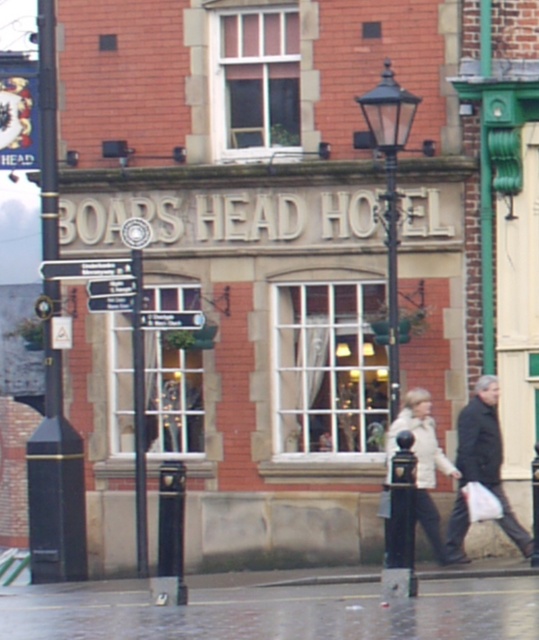
You are standing in front of the Boars Head Hotel and want to take a photo. There are two points of interest marked in the scene. The first point is at coordinates point (302, 632), and the second is at point (391, 445). Which point should you focus on to ensure it appears larger in your photo?

Point (302, 632) is closer to the camera than point (391, 445), so focusing on point (302, 632) will make it appear larger in the photo.

You are standing in front of the Boars Head Hotel and want to walk towards the black metal pole at left. Which direction should you move relative to the concrete pavement at lower center?

Since the concrete pavement at lower center is closer to the viewer than the black metal pole at left, you should move away from the concrete pavement at lower center to reach the black metal pole at left.

You are standing on the sidewalk in front of the Boars Head Hotel. You notice the concrete pavement at lower center and the white matte jacket at center. Which object is taller?

The white matte jacket at center is taller than the concrete pavement at lower center.